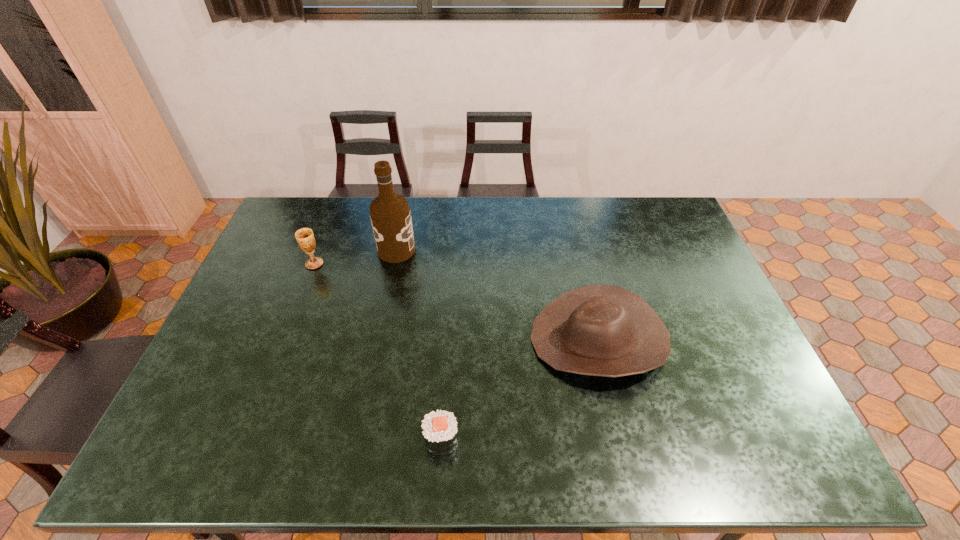
Where is `vacant space located on the left of the third object from left to right`? The height and width of the screenshot is (540, 960). vacant space located on the left of the third object from left to right is located at coordinates coord(257,440).

This screenshot has width=960, height=540. In order to click on object present at the near edge in this screenshot , I will do `click(439, 427)`.

Locate an element on the screen. object located at the left edge is located at coordinates (304, 236).

The width and height of the screenshot is (960, 540). In the image, there is a desktop. In order to click on vacant space at the far edge in this screenshot , I will do `click(531, 199)`.

The width and height of the screenshot is (960, 540). Identify the location of vacant space at the near edge. (648, 449).

This screenshot has height=540, width=960. In the image, there is a desktop. Find the location of `free space at the left edge`. free space at the left edge is located at coordinates (213, 379).

Find the location of a particular element. vacant space at the right edge of the desktop is located at coordinates (704, 369).

Identify the location of free space at the far left corner of the desktop. (285, 218).

This screenshot has width=960, height=540. I want to click on vacant region at the far right corner of the desktop, so click(646, 210).

I want to click on empty space between the cowboy hat and the alcohol, so click(x=497, y=295).